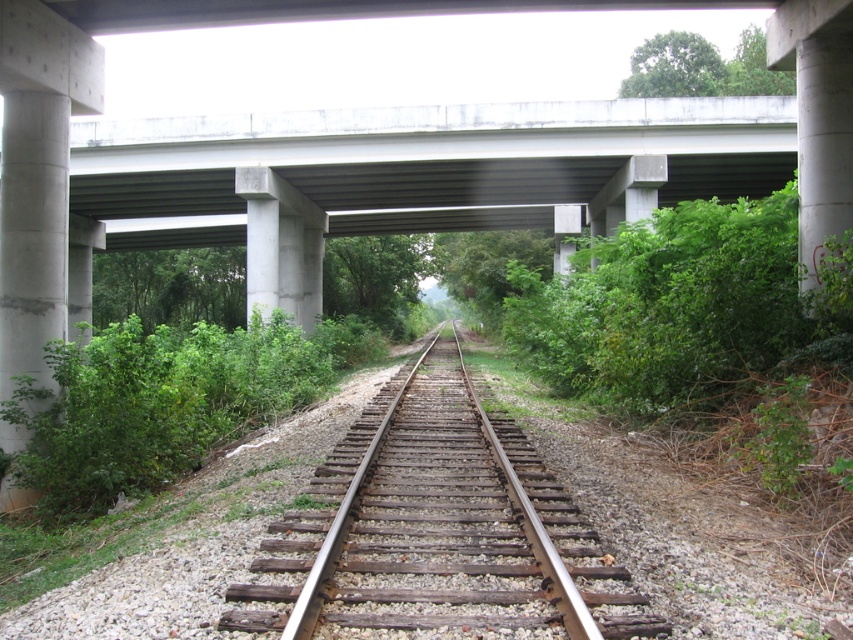
Question: Does rusty metal train track at center appear over concrete at left?

Choices:
 (A) yes
 (B) no

Answer: (B)

Question: Observing the image, what is the correct spatial positioning of concrete at left in reference to concrete at center?

Choices:
 (A) above
 (B) below

Answer: (A)

Question: Which point is farther to the camera?

Choices:
 (A) (299, 304)
 (B) (543, 564)
 (C) (55, 145)

Answer: (A)

Question: Among these objects, which one is farthest from the camera?

Choices:
 (A) concrete at center
 (B) concrete at left

Answer: (A)

Question: Where is rusty metal train track at center located in relation to concrete at left in the image?

Choices:
 (A) above
 (B) below

Answer: (B)

Question: Which point is farther to the camera?

Choices:
 (A) (247, 272)
 (B) (91, 106)
 (C) (431, 412)

Answer: (A)